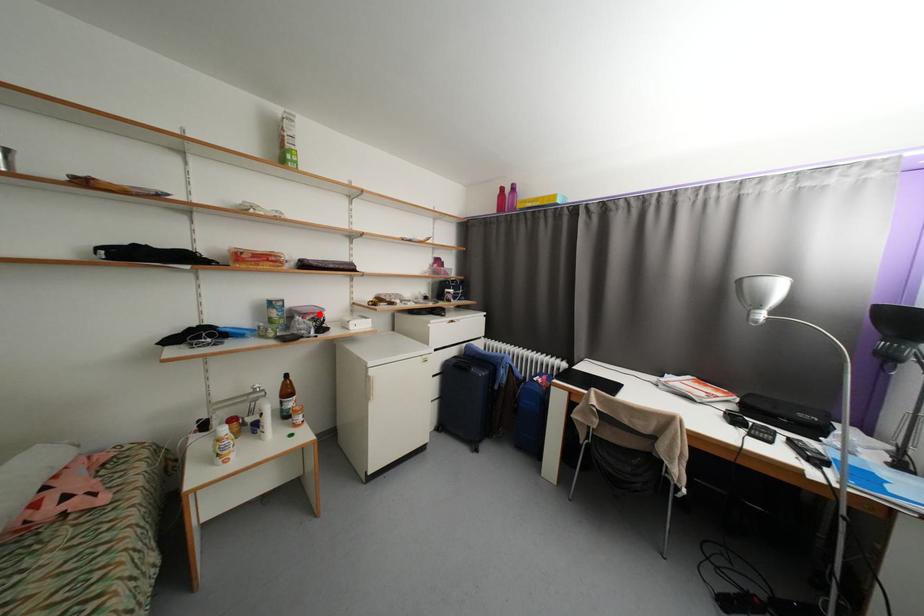
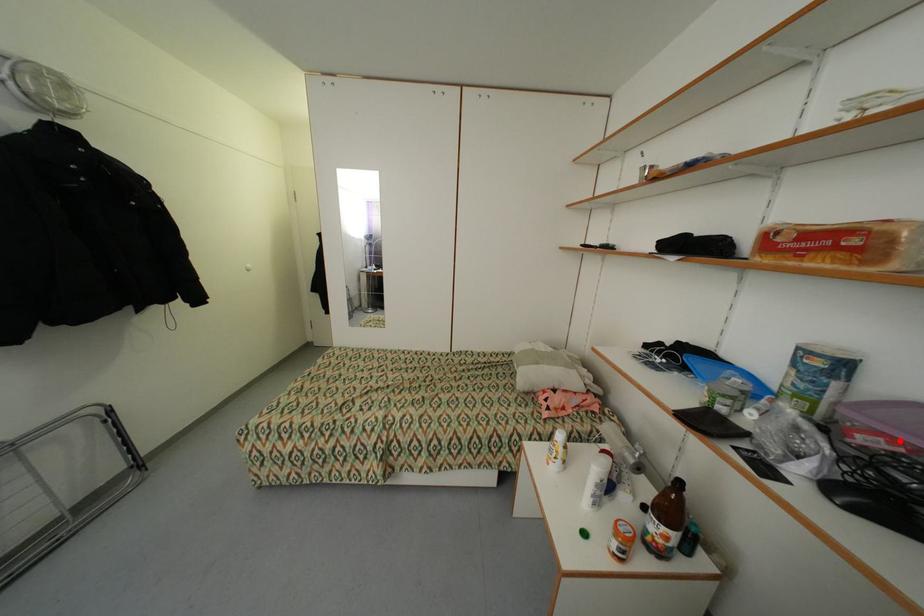
In the scene shown: I am providing you with two images of the same scene from different viewpoints. A red point is marked on the first image and another point is marked on the second image. Is the marked point in image1 the same physical position as the marked point in image2?

Yes